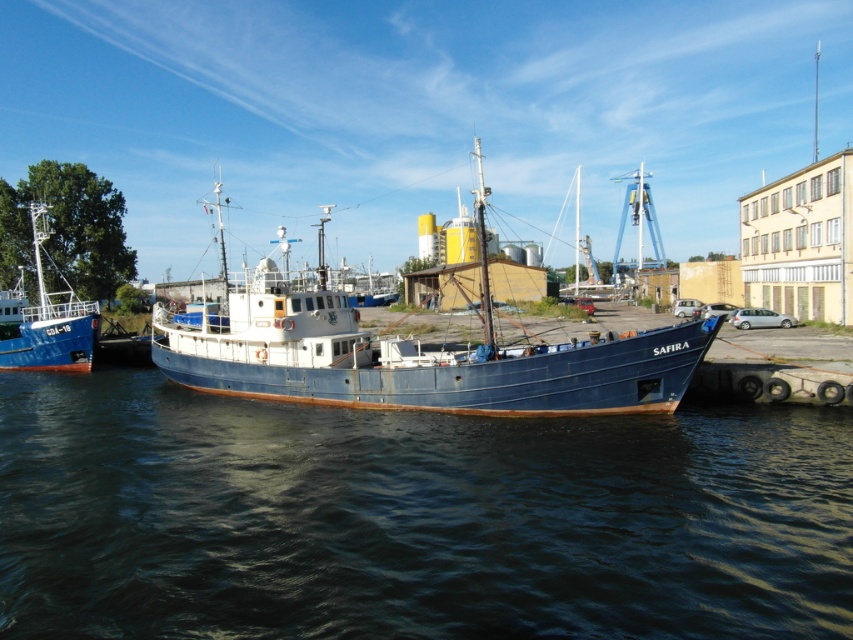
Question: From the image, what is the correct spatial relationship of dark blue water at center in relation to brushed metal boat at left?

Choices:
 (A) left
 (B) right

Answer: (B)

Question: Which object appears farthest from the camera in this image?

Choices:
 (A) dark blue water at center
 (B) rusty metal boat at center
 (C) brushed metal boat at left

Answer: (C)

Question: Does dark blue water at center have a greater width compared to brushed metal boat at left?

Choices:
 (A) no
 (B) yes

Answer: (B)

Question: Which of the following is the farthest from the observer?

Choices:
 (A) (387, 364)
 (B) (38, 280)
 (C) (155, 577)

Answer: (B)

Question: Is dark blue water at center to the right of rusty metal boat at center from the viewer's perspective?

Choices:
 (A) no
 (B) yes

Answer: (A)

Question: Estimate the real-world distances between objects in this image. Which object is farther from the brushed metal boat at left?

Choices:
 (A) dark blue water at center
 (B) rusty metal boat at center

Answer: (A)